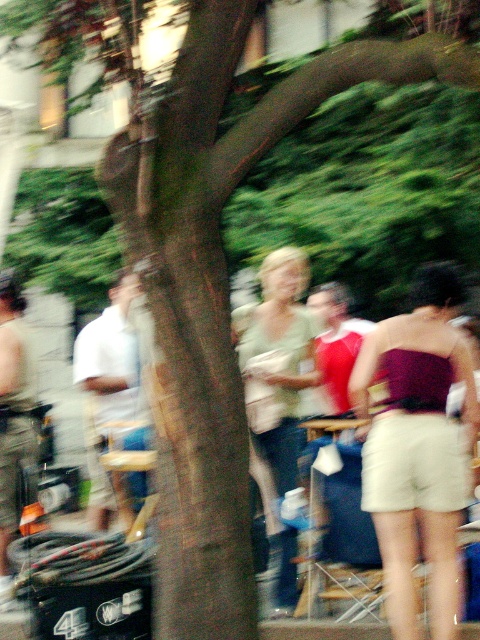
Question: Which point is closer to the camera?

Choices:
 (A) matte green shirt at center
 (B) maroon satin strapless top at center
 (C) white cotton shirt at left

Answer: (B)

Question: Can you confirm if maroon satin strapless top at center is smaller than white cotton shirt at left?

Choices:
 (A) yes
 (B) no

Answer: (A)

Question: Does matte green shirt at center have a greater width compared to white cotton shirt at left?

Choices:
 (A) no
 (B) yes

Answer: (A)

Question: Based on their relative distances, which object is farther from the matte green shirt at center?

Choices:
 (A) white cotton shirt at left
 (B) maroon satin strapless top at center

Answer: (A)

Question: Which object appears closest to the camera in this image?

Choices:
 (A) maroon satin strapless top at center
 (B) white cotton shirt at left
 (C) matte green shirt at center

Answer: (A)

Question: Does maroon satin strapless top at center appear under white cotton shirt at left?

Choices:
 (A) no
 (B) yes

Answer: (B)